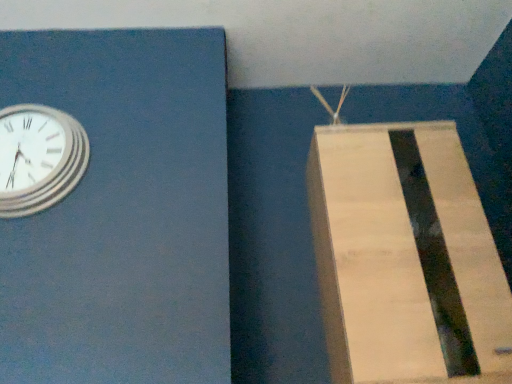
What do you see at coordinates (39, 158) in the screenshot? This screenshot has width=512, height=384. I see `silver metallic clock at upper left` at bounding box center [39, 158].

Locate an element on the screen. silver metallic clock at upper left is located at coordinates (x=39, y=158).

The height and width of the screenshot is (384, 512). What do you see at coordinates (405, 258) in the screenshot? I see `light brown cardboard at right` at bounding box center [405, 258].

Measure the distance between light brown cardboard at right and camera.

light brown cardboard at right is 3.62 feet away from camera.

The height and width of the screenshot is (384, 512). I want to click on light brown cardboard at right, so click(x=405, y=258).

Find the location of a particular element. silver metallic clock at upper left is located at coordinates (39, 158).

Considering the relative positions of silver metallic clock at upper left and light brown cardboard at right in the image provided, is silver metallic clock at upper left to the left or to the right of light brown cardboard at right?

From the image, it's evident that silver metallic clock at upper left is to the left of light brown cardboard at right.

Is silver metallic clock at upper left in front of light brown cardboard at right?

No, the depth of silver metallic clock at upper left is greater than that of light brown cardboard at right.

Which is less distant, (58, 144) or (476, 315)?

Clearly, point (58, 144) is more distant from the camera than point (476, 315).

In the scene shown: From the image's perspective, which object appears higher, silver metallic clock at upper left or light brown cardboard at right?

silver metallic clock at upper left.

From a real-world perspective, is silver metallic clock at upper left below light brown cardboard at right?

Incorrect, from a real-world perspective, silver metallic clock at upper left is higher than light brown cardboard at right.

In terms of width, does silver metallic clock at upper left look wider or thinner when compared to light brown cardboard at right?

silver metallic clock at upper left is thinner than light brown cardboard at right.

Is silver metallic clock at upper left taller than light brown cardboard at right?

No.

Between silver metallic clock at upper left and light brown cardboard at right, which one has larger size?

With larger size is light brown cardboard at right.

Does silver metallic clock at upper left contain light brown cardboard at right?

No, silver metallic clock at upper left does not contain light brown cardboard at right.

Is silver metallic clock at upper left next to light brown cardboard at right and touching it?

No, silver metallic clock at upper left is not touching light brown cardboard at right.

Could you tell me if silver metallic clock at upper left is turned towards light brown cardboard at right?

No.

What's the angular difference between silver metallic clock at upper left and light brown cardboard at right's facing directions?

0.000256 degrees.

Measure the distance between silver metallic clock at upper left and light brown cardboard at right.

silver metallic clock at upper left and light brown cardboard at right are 1.01 meters apart.

This screenshot has width=512, height=384. Find the location of `cardboard box on the right of silver metallic clock at upper left`. cardboard box on the right of silver metallic clock at upper left is located at coordinates (405, 258).

Considering the positions of objects light brown cardboard at right and silver metallic clock at upper left in the image provided, who is more to the left, light brown cardboard at right or silver metallic clock at upper left?

silver metallic clock at upper left.

Which is behind, light brown cardboard at right or silver metallic clock at upper left?

silver metallic clock at upper left.

Which is less distant, (481, 379) or (50, 170)?

The point (481, 379) is closer to the camera.

From the image's perspective, is light brown cardboard at right below silver metallic clock at upper left?

Indeed, from the image's perspective, light brown cardboard at right is shown beneath silver metallic clock at upper left.

From a real-world perspective, which is physically above, light brown cardboard at right or silver metallic clock at upper left?

silver metallic clock at upper left.

Between light brown cardboard at right and silver metallic clock at upper left, which one has smaller width?

silver metallic clock at upper left.

Considering the relative sizes of light brown cardboard at right and silver metallic clock at upper left in the image provided, is light brown cardboard at right taller than silver metallic clock at upper left?

Correct, light brown cardboard at right is much taller as silver metallic clock at upper left.

Looking at the image, does light brown cardboard at right seem bigger or smaller compared to silver metallic clock at upper left?

Clearly, light brown cardboard at right is larger in size than silver metallic clock at upper left.

Is silver metallic clock at upper left a part of light brown cardboard at right?

No, light brown cardboard at right does not contain silver metallic clock at upper left.

Are light brown cardboard at right and silver metallic clock at upper left located far from each other?

Yes.

Does light brown cardboard at right turn towards silver metallic clock at upper left?

No, light brown cardboard at right is not oriented towards silver metallic clock at upper left.

How many degrees apart are the facing directions of light brown cardboard at right and silver metallic clock at upper left?

0.000256 degrees.

Find the location of a particular element. cardboard box in front of the silver metallic clock at upper left is located at coordinates (405, 258).

What are the coordinates of `wall clock behind the light brown cardboard at right` in the screenshot? It's located at (39, 158).

Find the location of a particular element. The height and width of the screenshot is (384, 512). wall clock lying above the light brown cardboard at right (from the image's perspective) is located at coordinates click(39, 158).